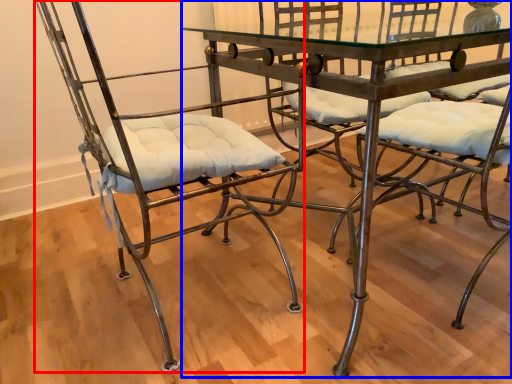
Question: Among these objects, which one is farthest to the camera, chair (highlighted by a red box) or table (highlighted by a blue box)?

Choices:
 (A) chair
 (B) table

Answer: (B)